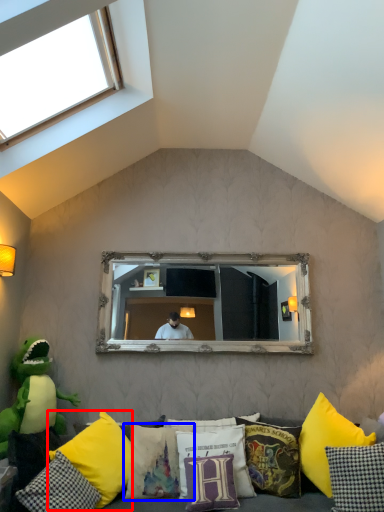
Question: Which object is further to the camera taking this photo, pillow (highlighted by a red box) or pillow (highlighted by a blue box)?

Choices:
 (A) pillow
 (B) pillow

Answer: (B)